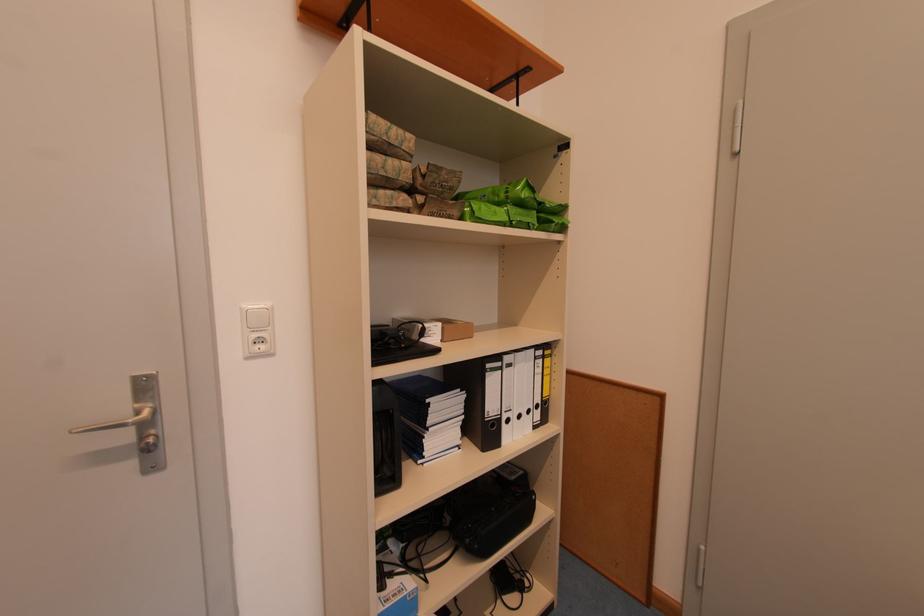
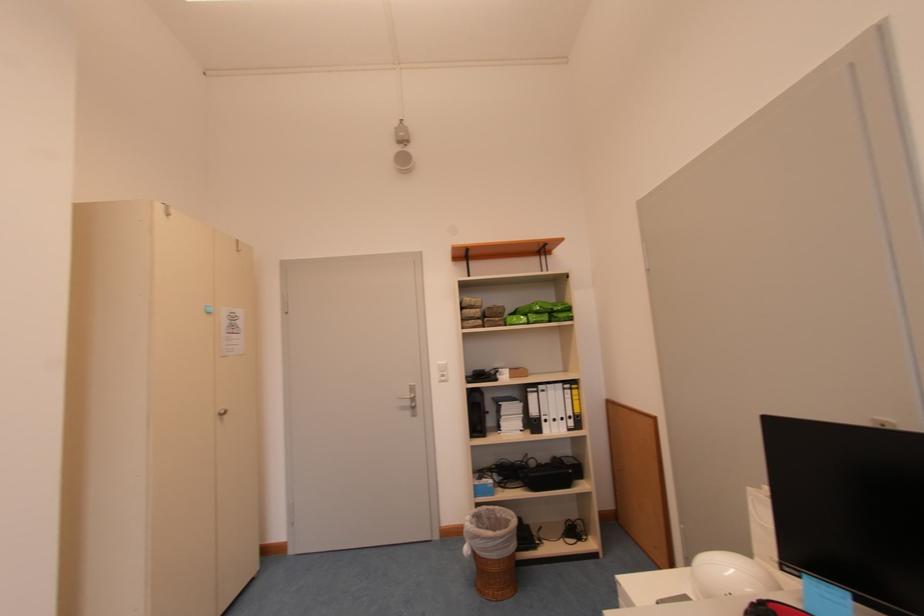
The point at (528, 207) is marked in the first image. Where is the corresponding point in the second image?

(543, 315)